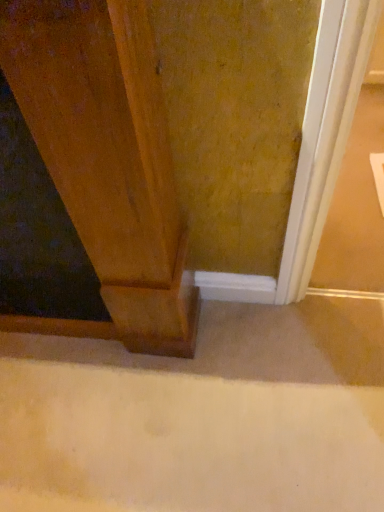
Question: From a real-world perspective, is wooden door at left located higher than beige carpet at lower center?

Choices:
 (A) yes
 (B) no

Answer: (A)

Question: From a real-world perspective, is wooden door at left positioned under beige carpet at lower center based on gravity?

Choices:
 (A) no
 (B) yes

Answer: (A)

Question: From the image's perspective, is wooden door at left under beige carpet at lower center?

Choices:
 (A) yes
 (B) no

Answer: (B)

Question: Is the depth of wooden door at left greater than that of beige carpet at lower center?

Choices:
 (A) yes
 (B) no

Answer: (B)

Question: Can you confirm if wooden door at left is positioned to the right of beige carpet at lower center?

Choices:
 (A) yes
 (B) no

Answer: (B)

Question: Does wooden door at left have a lesser height compared to beige carpet at lower center?

Choices:
 (A) yes
 (B) no

Answer: (B)

Question: Considering the relative sizes of beige carpet at lower center and wooden door at left in the image provided, is beige carpet at lower center shorter than wooden door at left?

Choices:
 (A) no
 (B) yes

Answer: (B)

Question: Is the position of beige carpet at lower center more distant than that of wooden door at left?

Choices:
 (A) yes
 (B) no

Answer: (A)

Question: From a real-world perspective, is beige carpet at lower center beneath wooden door at left?

Choices:
 (A) no
 (B) yes

Answer: (B)

Question: From the image's perspective, would you say beige carpet at lower center is shown under wooden door at left?

Choices:
 (A) yes
 (B) no

Answer: (A)

Question: Is the position of beige carpet at lower center less distant than that of wooden door at left?

Choices:
 (A) no
 (B) yes

Answer: (A)

Question: From the image's perspective, is beige carpet at lower center on top of wooden door at left?

Choices:
 (A) yes
 (B) no

Answer: (B)

Question: Considering the positions of beige carpet at lower center and wooden door at left in the image, is beige carpet at lower center wider or thinner than wooden door at left?

Choices:
 (A) wide
 (B) thin

Answer: (A)